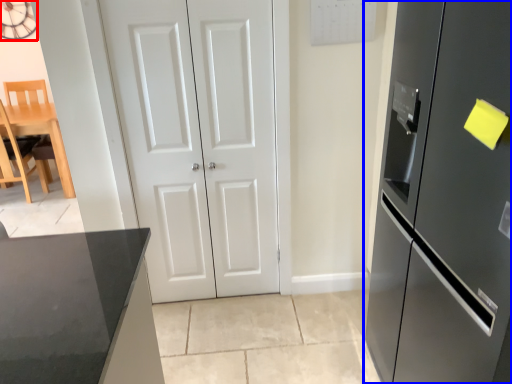
Question: Which point is further to the camera, clock (highlighted by a red box) or refrigerator (highlighted by a blue box)?

Choices:
 (A) clock
 (B) refrigerator

Answer: (A)